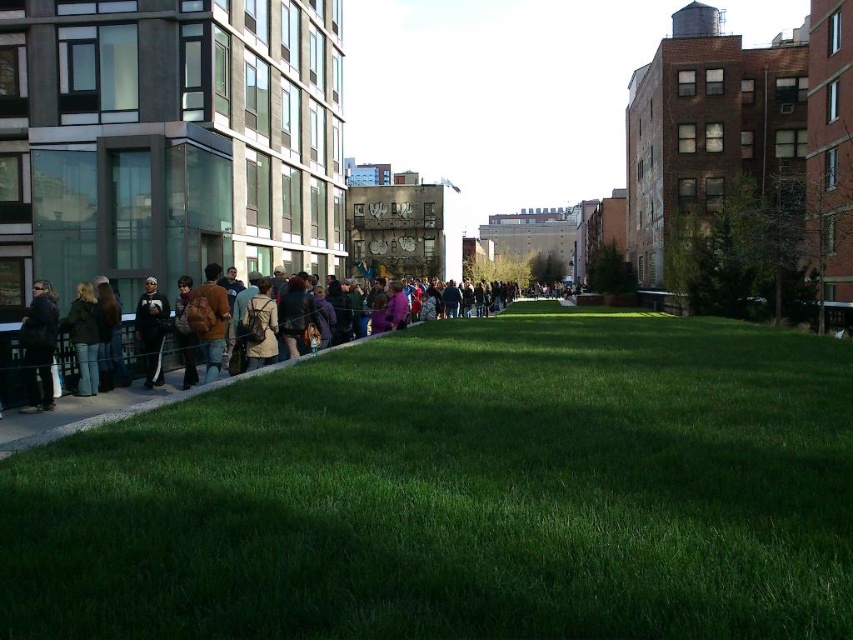
You are a photographer setting up a tripod in the grassy area. You notice the dark brown leather jacket at left and the dark gray hoodie at left in the frame. Which clothing item should you adjust your camera angle to avoid cropping if you want to capture both fully?

The dark brown leather jacket at left might be wider than dark gray hoodie at left, so you should adjust your camera angle to ensure the wider dark brown leather jacket at left is fully in frame.

You are a photographer wanting to capture both the dark brown leather jacket at left and the dark gray hoodie at left in the same frame. Which clothing item is positioned more to the left?

The dark brown leather jacket at left is positioned more to the left than the dark gray hoodie at left.